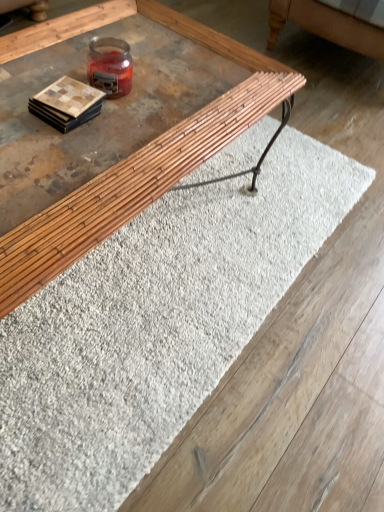
You are a GUI agent. You are given a task and a screenshot of the screen. Output one action in this format:
    pyautogui.click(x=<x>, y=<y>)
    Task: Click on the natural wood table at center
    
    Given the screenshot: What is the action you would take?
    pyautogui.click(x=135, y=152)

The height and width of the screenshot is (512, 384). Describe the element at coordinates (135, 152) in the screenshot. I see `natural wood table at center` at that location.

Find the location of a particular element. The height and width of the screenshot is (512, 384). natural wood table at center is located at coordinates (135, 152).